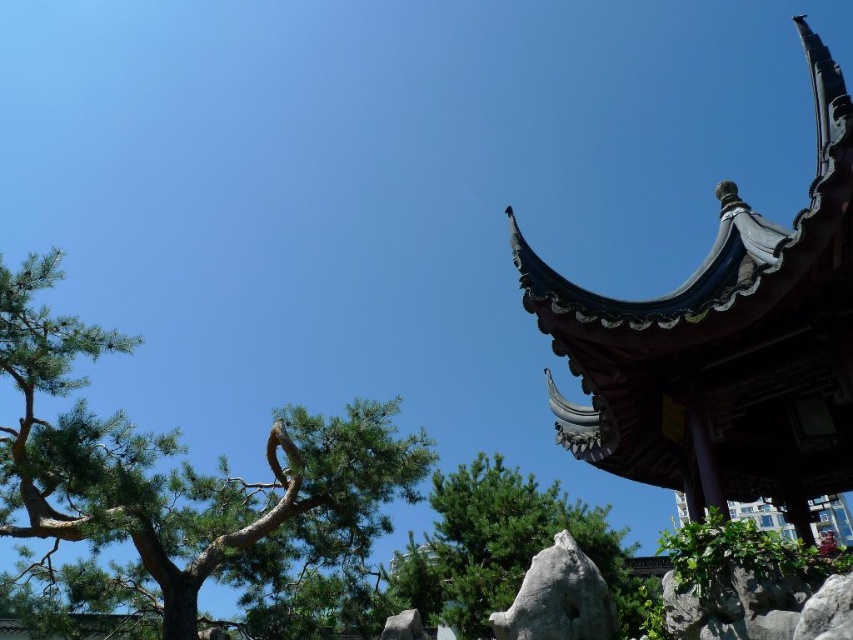
Is the position of green rough bark tree at upper left less distant than that of gray rough rock at center?

That is False.

Locate an element on the screen. The width and height of the screenshot is (853, 640). green rough bark tree at upper left is located at coordinates (171, 490).

Which is in front, point (165, 515) or point (572, 541)?

Point (572, 541) is in front.

Find the location of a particular element. The height and width of the screenshot is (640, 853). green rough bark tree at upper left is located at coordinates [x=171, y=490].

Which of these two, green textured tree at center or gray rough rock at center, stands shorter?

Standing shorter between the two is gray rough rock at center.

In the scene shown: Does green textured tree at center appear on the left side of gray rough rock at center?

In fact, green textured tree at center is to the right of gray rough rock at center.

Is point (401, 604) closer to viewer compared to point (569, 566)?

No, it is not.

The height and width of the screenshot is (640, 853). In order to click on green textured tree at center in this screenshot , I will do `click(505, 547)`.

Who is more distant from viewer, (3, 456) or (469, 472)?

The point (469, 472) is more distant.

Between point (88, 444) and point (503, 531), which one is positioned in front?

Positioned in front is point (88, 444).

What are the coordinates of `green rough bark tree at upper left` in the screenshot? It's located at (171, 490).